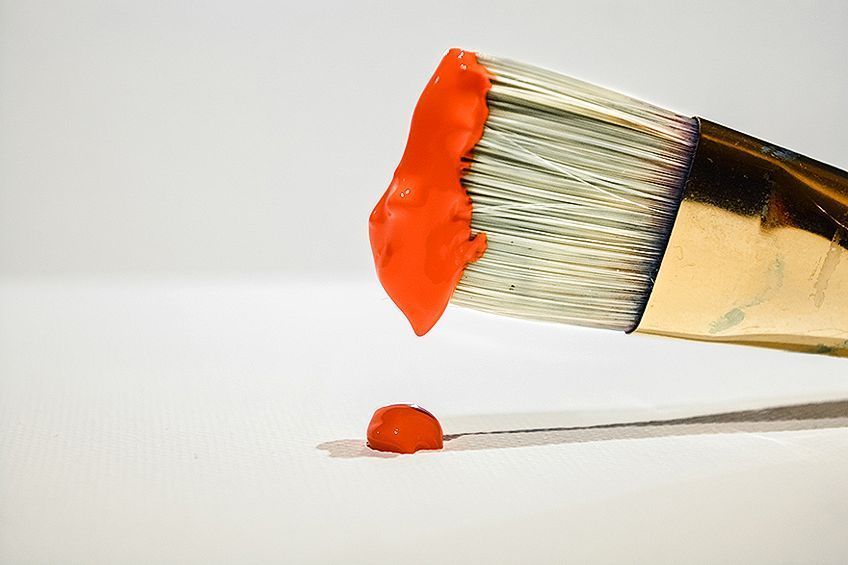
In order to click on other kind of paint on brush in this screenshot , I will do `click(728, 318)`, `click(773, 276)`, `click(778, 156)`.